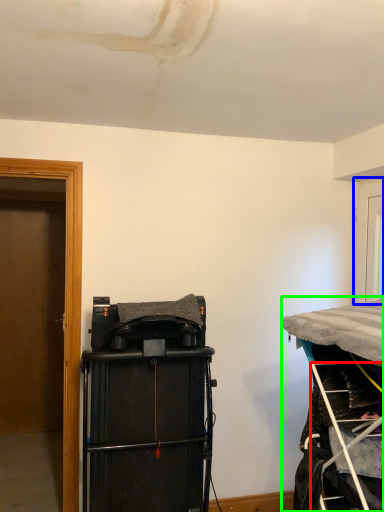
Question: Considering the real-world distances, which object is closest to ladder (highlighted by a red box)? door (highlighted by a blue box) or furniture (highlighted by a green box).

Choices:
 (A) door
 (B) furniture

Answer: (B)